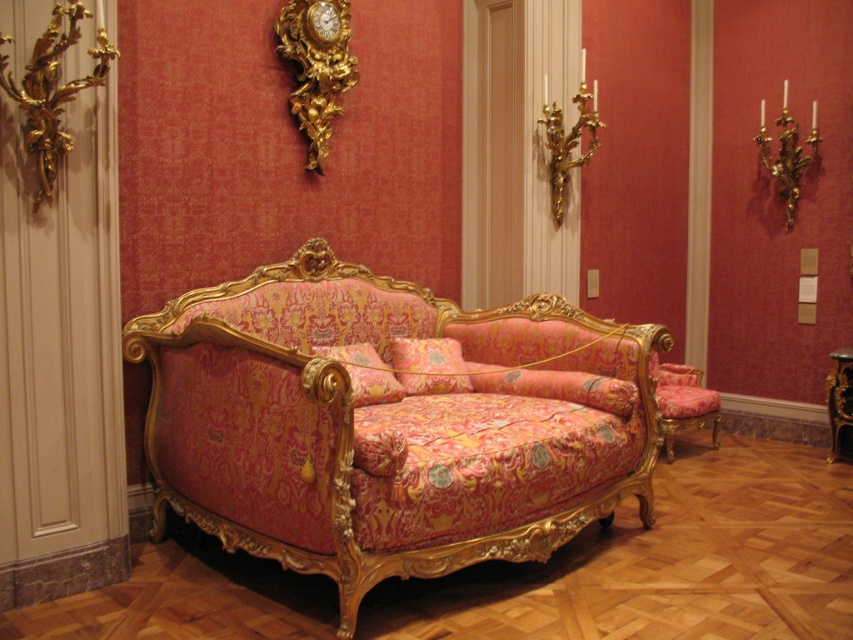
Question: Does gold ornate clock at upper center appear on the left side of velvet floral armchair at center?

Choices:
 (A) yes
 (B) no

Answer: (A)

Question: Among these objects, which one is nearest to the camera?

Choices:
 (A) gold-patterned fabric couch at center
 (B) gold ornate clock at upper center

Answer: (A)

Question: Can you confirm if gold-patterned fabric couch at center is wider than gold ornate clock at upper center?

Choices:
 (A) no
 (B) yes

Answer: (B)

Question: Can you confirm if gold-patterned fabric couch at center is thinner than gold ornate clock at upper center?

Choices:
 (A) no
 (B) yes

Answer: (A)

Question: Which object is positioned farthest from the velvet floral armchair at center?

Choices:
 (A) gold ornate clock at upper center
 (B) gold-patterned fabric couch at center

Answer: (A)

Question: Which is farther from the velvet floral armchair at center?

Choices:
 (A) gold ornate clock at upper center
 (B) gold-patterned fabric couch at center

Answer: (A)